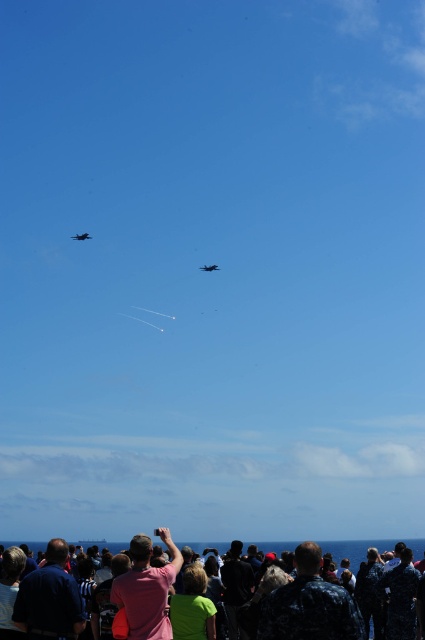
You are a photographer trying to capture the crowd and the jets in one shot. Given that the dark blue uniform at lower center and the shiny dark blue jet at center are in your frame, which object will appear wider in your photo?

The shiny dark blue jet at center will appear wider in the photo because it has a greater width compared to the dark blue uniform at lower center.

You are standing in the crowd watching the shiny dark blue jet at center. Which direction should you turn to see the dark blue uniform at lower right?

You should turn to your right to see the dark blue uniform at lower right because it is located to the right of the shiny dark blue jet at center.

You are a photographer standing at the edge of the crowd. You want to take a photo of the shiny dark blue jet at center without any people blocking it. Can you adjust your position so that the dark blue uniform at lower center is not in the way?

The dark blue uniform at lower center is in front of the shiny dark blue jet at center, so you cannot take a photo of the shiny dark blue jet at center without the dark blue uniform at lower center blocking it unless you move to a position where the dark blue uniform at lower center is no longer between you and the jet.